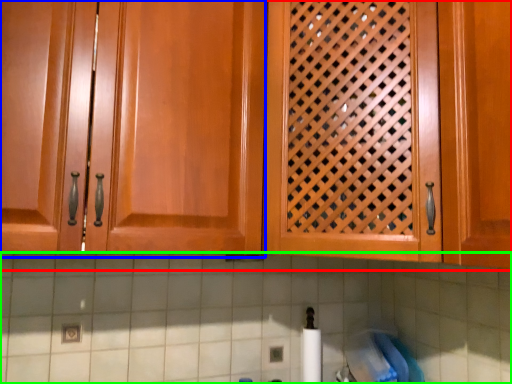
Question: Based on their relative distances, which object is nearer to cabinetry (highlighted by a red box)? Choose from cabinetry (highlighted by a blue box) and granite (highlighted by a green box).

Choices:
 (A) cabinetry
 (B) granite

Answer: (A)